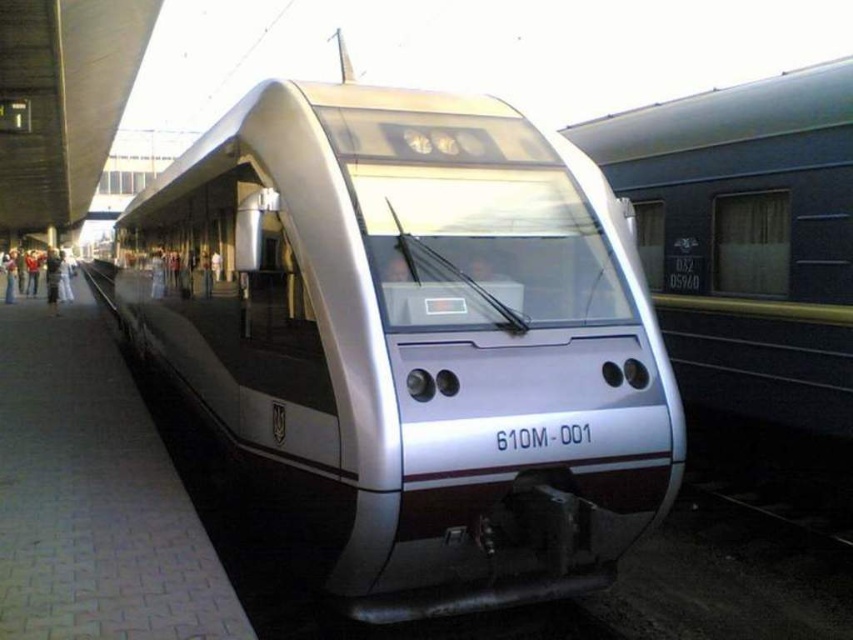
Question: Which point appears closest to the camera in this image?

Choices:
 (A) (525, 550)
 (B) (42, 509)
 (C) (659, 124)

Answer: (A)

Question: Is metallic silver train at center bigger than gray concrete platform at center?

Choices:
 (A) yes
 (B) no

Answer: (B)

Question: Which object appears closest to the camera in this image?

Choices:
 (A) gray concrete platform at center
 (B) metallic silver train at center

Answer: (A)

Question: Does silver metallic train at center appear over metallic silver train at center?

Choices:
 (A) no
 (B) yes

Answer: (A)

Question: Among these points, which one is nearest to the camera?

Choices:
 (A) (154, 589)
 (B) (195, 196)

Answer: (A)

Question: Is metallic silver train at center thinner than gray concrete platform at center?

Choices:
 (A) yes
 (B) no

Answer: (A)